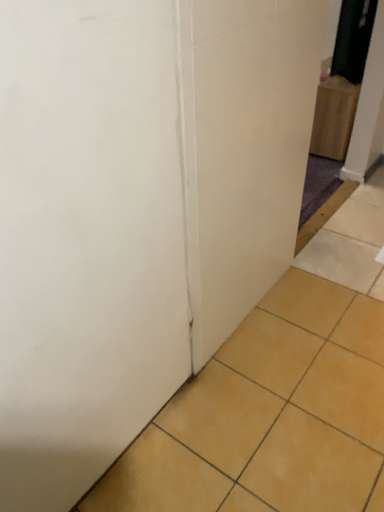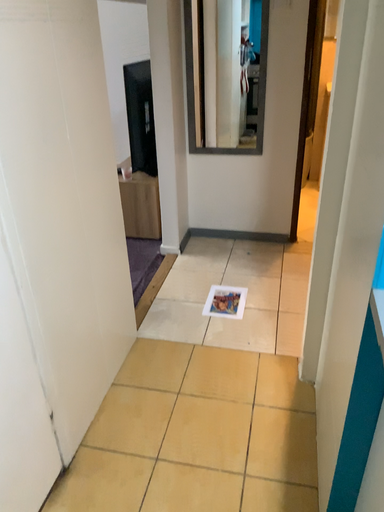
Question: Which way did the camera rotate in the video?

Choices:
 (A) rotated right
 (B) rotated left

Answer: (A)